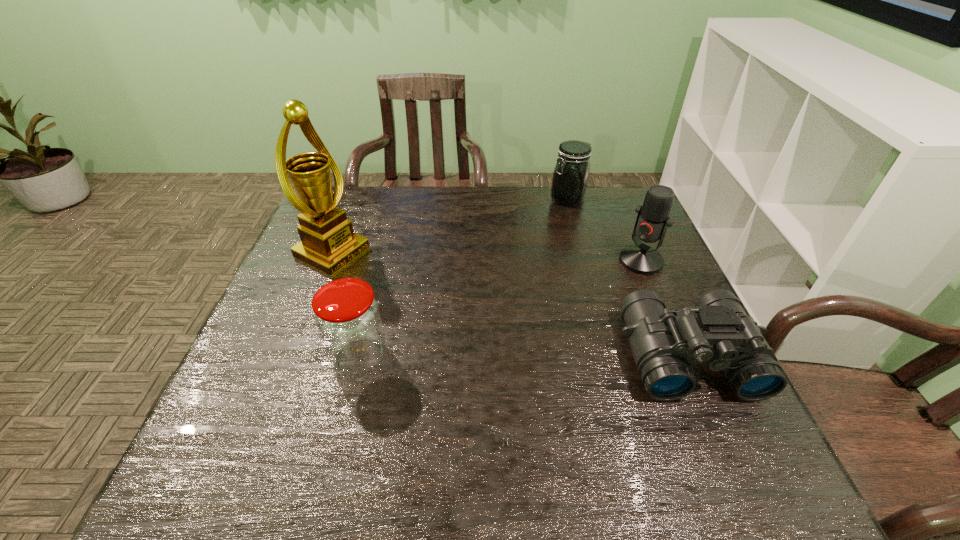
The height and width of the screenshot is (540, 960). I want to click on vacant space that satisfies the following two spatial constraints: 1. on the back side of the farther jar; 2. on the right side of the tallest object, so click(x=353, y=199).

The height and width of the screenshot is (540, 960). In order to click on vacant region that satisfies the following two spatial constraints: 1. on the back side of the left jar; 2. on the right side of the farther jar in this screenshot , I will do `click(398, 199)`.

Where is `free space that satisfies the following two spatial constraints: 1. on the back side of the nearer jar; 2. on the right side of the microphone`? free space that satisfies the following two spatial constraints: 1. on the back side of the nearer jar; 2. on the right side of the microphone is located at coordinates (383, 261).